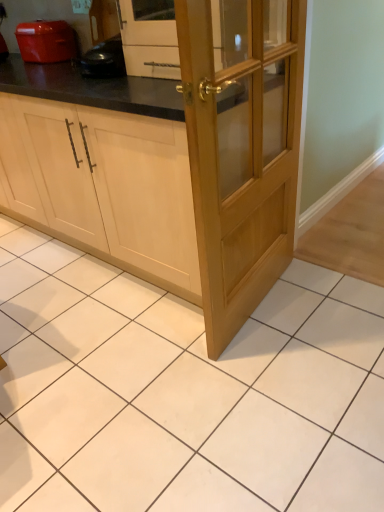
Question: Is the depth of light wood/glass door at center less than that of light wood cabinet at center?

Choices:
 (A) no
 (B) yes

Answer: (B)

Question: From a real-world perspective, is light wood/glass door at center below light wood cabinet at center?

Choices:
 (A) no
 (B) yes

Answer: (A)

Question: Is light wood/glass door at center oriented away from light wood cabinet at center?

Choices:
 (A) no
 (B) yes

Answer: (B)

Question: Can you confirm if light wood/glass door at center is thinner than light wood cabinet at center?

Choices:
 (A) yes
 (B) no

Answer: (A)

Question: Is there a large distance between light wood/glass door at center and light wood cabinet at center?

Choices:
 (A) yes
 (B) no

Answer: (B)

Question: From a real-world perspective, is light wood/glass door at center positioned over light wood cabinet at center based on gravity?

Choices:
 (A) yes
 (B) no

Answer: (A)

Question: Does light wood cabinet at center appear on the left side of matte orange toaster at upper left?

Choices:
 (A) yes
 (B) no

Answer: (A)

Question: From the image's perspective, is light wood cabinet at center above matte orange toaster at upper left?

Choices:
 (A) yes
 (B) no

Answer: (B)

Question: Is light wood cabinet at center beside matte orange toaster at upper left?

Choices:
 (A) yes
 (B) no

Answer: (B)

Question: Is light wood cabinet at center to the right of matte orange toaster at upper left from the viewer's perspective?

Choices:
 (A) no
 (B) yes

Answer: (A)

Question: Can you confirm if light wood cabinet at center is thinner than matte orange toaster at upper left?

Choices:
 (A) yes
 (B) no

Answer: (B)

Question: Is there a large distance between light wood cabinet at center and matte orange toaster at upper left?

Choices:
 (A) yes
 (B) no

Answer: (B)

Question: Is matte orange toaster at upper left positioned far away from light wood cabinet at center?

Choices:
 (A) yes
 (B) no

Answer: (B)